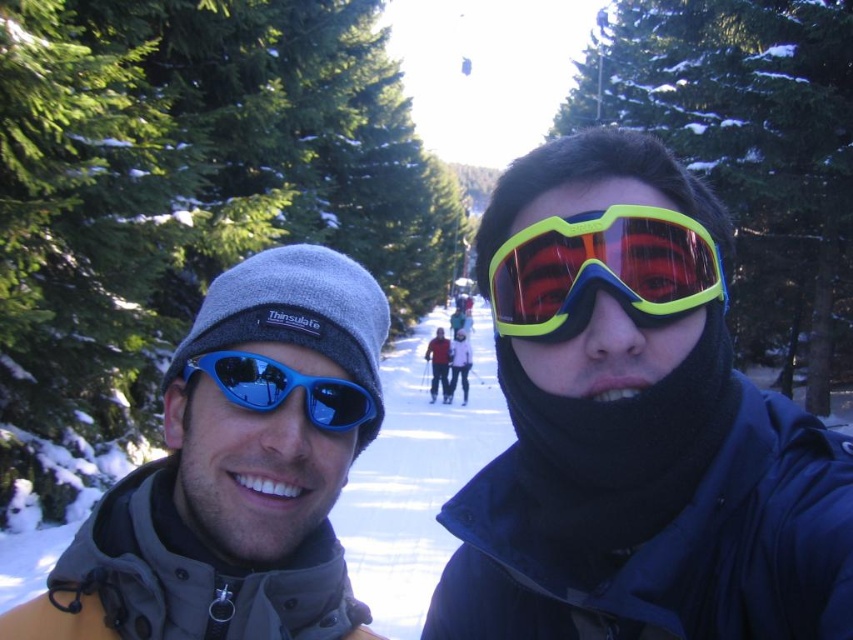
You are a photographer trying to capture a wide shot of the two people in the winter scene. You notice the matte blue sunglasses at left and the matte blue ski at center. Which object is wider when viewed from your camera position?

The matte blue sunglasses at left is wider than the matte blue ski at center, so the sunglasses would appear wider in the photo.

You are a photographer trying to capture the perfect shot of the two people in the winter scene. You notice there is a point at coordinates (236, 470). What object from the scene is located at this point?

The point at coordinates (236, 470) corresponds to the matte blue sunglasses at left.

Looking at this image, you are a photographer trying to capture a closeup of the matte black ski goggles at center and the matte blue sunglasses at center. Which object is located higher in the image?

The matte black ski goggles at center is positioned over the matte blue sunglasses at center, so it is higher in the image.